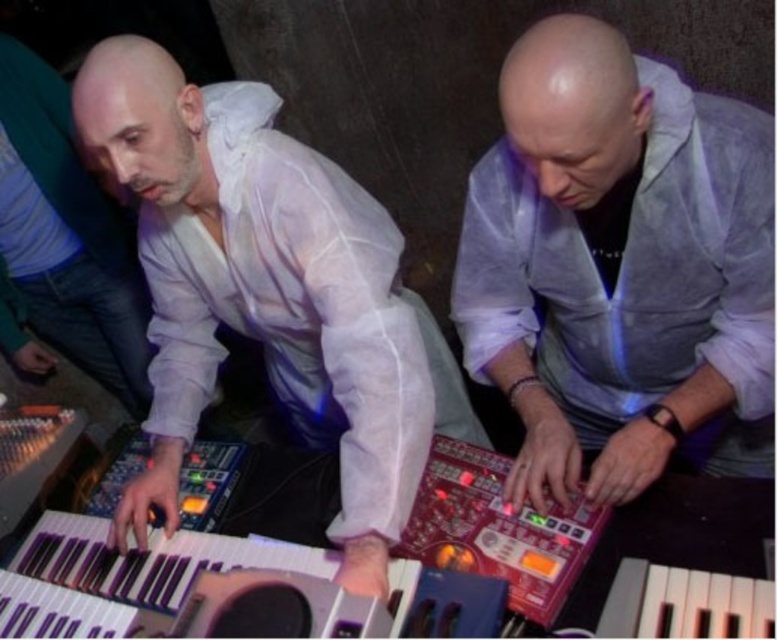
You are a photographer positioned at the entrance of the studio. You notice two white shirts at the center of the scene. Which one is nearer to you, the translucent white shirt at center or the white sheer shirt at center?

The translucent white shirt at center is closer to the viewer than the white sheer shirt at center, so the translucent white shirt at center is nearer to you.

You are a photographer positioned in front of the translucent white shirt at center. You want to capture a closeup shot of the shirt. Based on the given information, what is the minimum distance you need to maintain from the shirt to ensure it is in focus?

The minimum distance you need to maintain from the translucent white shirt at center is 33.57 inches to ensure it is in focus.

Consider the image. You are a photographer in a dimly lit studio. You want to take a closeup photo of the metallic keyboard at lower left but need to ensure there is enough space between the white sheer shirt at center and the keyboard to avoid the shirt being in the frame. Can you fit your camera between them?

The white sheer shirt at center is 13.84 inches away from the metallic keyboard at lower left. This distance should be sufficient to fit a camera between them without the shirt obstructing the keyboard in the frame.